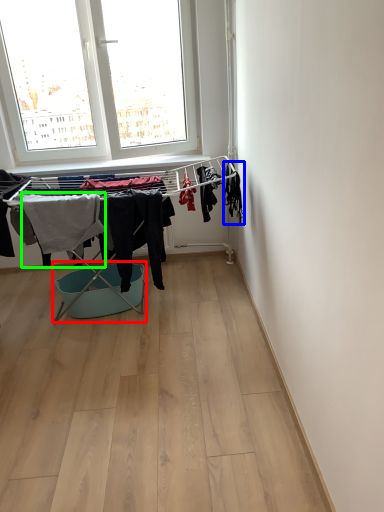
Question: Based on their relative distances, which object is farther from laundry basket (highlighted by a red box)? Choose from clothing (highlighted by a blue box) and clothing (highlighted by a green box).

Choices:
 (A) clothing
 (B) clothing

Answer: (A)